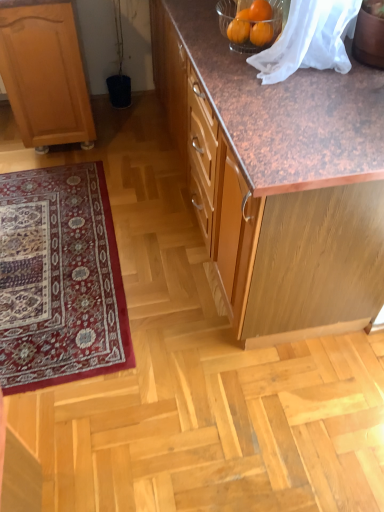
The image size is (384, 512). What do you see at coordinates (261, 33) in the screenshot?
I see `orange matte at upper center, acting as the second orange starting from the top` at bounding box center [261, 33].

Measure the distance between point [229,242] and camera.

A distance of 1.51 meters exists between point [229,242] and camera.

Where is `brown wood cabinet at center, which is counted as the 2th cabinetry, starting from the left`? The height and width of the screenshot is (512, 384). brown wood cabinet at center, which is counted as the 2th cabinetry, starting from the left is located at coordinates (288, 183).

This screenshot has height=512, width=384. Describe the element at coordinates (45, 75) in the screenshot. I see `light brown wood cabinet at left, the 1th cabinetry from the left` at that location.

The height and width of the screenshot is (512, 384). Identify the location of orange matte at upper right, the 1th orange when ordered from top to bottom. (260, 11).

The height and width of the screenshot is (512, 384). Identify the location of carpeted rug at lower left. (59, 279).

In the scene shown: Can you confirm if brown wood cabinet at center, which is counted as the 2th cabinetry, starting from the left, is wider than orange matte at upper right, marked as the 2th orange in a bottom-to-top arrangement?

Indeed, brown wood cabinet at center, which is counted as the 2th cabinetry, starting from the left, has a greater width compared to orange matte at upper right, marked as the 2th orange in a bottom-to-top arrangement.

Is brown wood cabinet at center, which is counted as the 2th cabinetry, starting from the left, positioned far away from orange matte at upper right, the 1th orange when ordered from top to bottom?

Actually, brown wood cabinet at center, which is counted as the 2th cabinetry, starting from the left, and orange matte at upper right, the 1th orange when ordered from top to bottom, are a little close together.

Does brown wood cabinet at center, the 1th cabinetry positioned from the right, have a larger size compared to orange matte at upper right, the 1th orange when ordered from top to bottom?

Yes, brown wood cabinet at center, the 1th cabinetry positioned from the right, is bigger than orange matte at upper right, the 1th orange when ordered from top to bottom.

Is brown wood cabinet at center, which is counted as the 2th cabinetry, starting from the left, facing towards orange matte at upper right, the 1th orange when ordered from top to bottom?

No, brown wood cabinet at center, which is counted as the 2th cabinetry, starting from the left, is not aimed at orange matte at upper right, the 1th orange when ordered from top to bottom.

Is carpeted rug at lower left in front of orange matte at upper right, the 1th orange when ordered from top to bottom?

That is False.

What's the angular difference between carpeted rug at lower left and orange matte at upper right, marked as the 2th orange in a bottom-to-top arrangement,'s facing directions?

The facing directions of carpeted rug at lower left and orange matte at upper right, marked as the 2th orange in a bottom-to-top arrangement, are 95.5 degrees apart.

Who is taller, carpeted rug at lower left or orange matte at upper right, the 1th orange when ordered from top to bottom?

orange matte at upper right, the 1th orange when ordered from top to bottom, is taller.

From the image's perspective, is carpeted rug at lower left beneath orange matte at upper right, marked as the 2th orange in a bottom-to-top arrangement?

Yes, from the image's perspective, carpeted rug at lower left is beneath orange matte at upper right, marked as the 2th orange in a bottom-to-top arrangement.

Is orange matte at upper center, placed as the first orange when sorted from bottom to top, in front of or behind brown wood cabinet at center, the 1th cabinetry positioned from the right, in the image?

orange matte at upper center, placed as the first orange when sorted from bottom to top, is behind brown wood cabinet at center, the 1th cabinetry positioned from the right.

Looking at the image, does orange matte at upper center, acting as the second orange starting from the top, seem bigger or smaller compared to brown wood cabinet at center, which is counted as the 2th cabinetry, starting from the left?

Clearly, orange matte at upper center, acting as the second orange starting from the top, is smaller in size than brown wood cabinet at center, which is counted as the 2th cabinetry, starting from the left.

Is orange matte at upper center, acting as the second orange starting from the top, shorter than brown wood cabinet at center, the 1th cabinetry positioned from the right?

Indeed, orange matte at upper center, acting as the second orange starting from the top, has a lesser height compared to brown wood cabinet at center, the 1th cabinetry positioned from the right.

From a real-world perspective, which object stands above the other?

In real-world perspective, orange matte at upper center, placed as the first orange when sorted from bottom to top, is above.

Can you confirm if light brown wood cabinet at left, the 1th cabinetry from the left, is positioned to the left of orange matte at upper right, the 1th orange when ordered from top to bottom?

Indeed, light brown wood cabinet at left, the 1th cabinetry from the left, is positioned on the left side of orange matte at upper right, the 1th orange when ordered from top to bottom.

Can we say light brown wood cabinet at left, the second cabinetry positioned from the right, lies outside orange matte at upper right, the 1th orange when ordered from top to bottom?

light brown wood cabinet at left, the second cabinetry positioned from the right, lies outside orange matte at upper right, the 1th orange when ordered from top to bottom,'s area.

Does light brown wood cabinet at left, the second cabinetry positioned from the right, touch orange matte at upper right, marked as the 2th orange in a bottom-to-top arrangement?

They are not placed beside each other.

From the image's perspective, is orange matte at upper right, the 1th orange when ordered from top to bottom, above brown wood cabinet at center, the 1th cabinetry positioned from the right?

Correct, orange matte at upper right, the 1th orange when ordered from top to bottom, appears higher than brown wood cabinet at center, the 1th cabinetry positioned from the right, in the image.

Which object is thinner, orange matte at upper right, marked as the 2th orange in a bottom-to-top arrangement, or brown wood cabinet at center, the 1th cabinetry positioned from the right?

orange matte at upper right, marked as the 2th orange in a bottom-to-top arrangement, is thinner.

Is orange matte at upper right, the 1th orange when ordered from top to bottom, facing towards brown wood cabinet at center, which is counted as the 2th cabinetry, starting from the left?

No, orange matte at upper right, the 1th orange when ordered from top to bottom, is not turned towards brown wood cabinet at center, which is counted as the 2th cabinetry, starting from the left.

Considering the sizes of orange matte at upper right, marked as the 2th orange in a bottom-to-top arrangement, and brown wood cabinet at center, the 1th cabinetry positioned from the right, in the image, is orange matte at upper right, marked as the 2th orange in a bottom-to-top arrangement, bigger or smaller than brown wood cabinet at center, the 1th cabinetry positioned from the right,?

Clearly, orange matte at upper right, marked as the 2th orange in a bottom-to-top arrangement, is smaller in size than brown wood cabinet at center, the 1th cabinetry positioned from the right.

Does orange matte at upper center, acting as the second orange starting from the top, have a greater width compared to light brown wood cabinet at left, the second cabinetry positioned from the right?

No, orange matte at upper center, acting as the second orange starting from the top, is not wider than light brown wood cabinet at left, the second cabinetry positioned from the right.

Is the position of orange matte at upper center, placed as the first orange when sorted from bottom to top, less distant than that of light brown wood cabinet at left, the 1th cabinetry from the left?

Yes, orange matte at upper center, placed as the first orange when sorted from bottom to top, is closer to the viewer.

Does orange matte at upper center, acting as the second orange starting from the top, have a greater height compared to light brown wood cabinet at left, the 1th cabinetry from the left?

Incorrect, the height of orange matte at upper center, acting as the second orange starting from the top, is not larger of that of light brown wood cabinet at left, the 1th cabinetry from the left.

In the scene shown: Is brown wood cabinet at center, the 1th cabinetry positioned from the right, outside of light brown wood cabinet at left, the second cabinetry positioned from the right?

Yes, brown wood cabinet at center, the 1th cabinetry positioned from the right, is located beyond the bounds of light brown wood cabinet at left, the second cabinetry positioned from the right.

Which is more to the left, brown wood cabinet at center, which is counted as the 2th cabinetry, starting from the left, or light brown wood cabinet at left, the second cabinetry positioned from the right?

light brown wood cabinet at left, the second cabinetry positioned from the right, is more to the left.

I want to click on cabinetry that appears below the light brown wood cabinet at left, the 1th cabinetry from the left (from the image's perspective), so click(288, 183).

Is brown wood cabinet at center, the 1th cabinetry positioned from the right, aimed at light brown wood cabinet at left, the second cabinetry positioned from the right?

Yes.

From a real-world perspective, count 2nd oranges upward from the brown wood cabinet at center, which is counted as the 2th cabinetry, starting from the left, and point to it. Please provide its 2D coordinates.

[(260, 11)]

You are a GUI agent. You are given a task and a screenshot of the screen. Output one action in this format:
    pyautogui.click(x=<x>, y=<y>)
    Task: Click on the 1st orange to the right of the carpeted rug at lower left, starting your count from the anchor
    The height and width of the screenshot is (512, 384).
    Given the screenshot: What is the action you would take?
    click(260, 11)

In the scene shown: Which object lies further to the anchor point carpeted rug at lower left, brown wood cabinet at center, which is counted as the 2th cabinetry, starting from the left, or orange matte at upper right, the 1th orange when ordered from top to bottom?

orange matte at upper right, the 1th orange when ordered from top to bottom, is further to carpeted rug at lower left.

Consider the image. Considering their positions, is brown wood cabinet at center, the 1th cabinetry positioned from the right, positioned closer to light brown wood cabinet at left, the second cabinetry positioned from the right, than orange matte at upper center, placed as the first orange when sorted from bottom to top?

Among the two, brown wood cabinet at center, the 1th cabinetry positioned from the right, is located nearer to light brown wood cabinet at left, the second cabinetry positioned from the right.

From the image, which object appears to be nearer to orange matte at upper right, the 1th orange when ordered from top to bottom, brown wood cabinet at center, which is counted as the 2th cabinetry, starting from the left, or light brown wood cabinet at left, the 1th cabinetry from the left?

Based on the image, brown wood cabinet at center, which is counted as the 2th cabinetry, starting from the left, appears to be nearer to orange matte at upper right, the 1th orange when ordered from top to bottom.

Estimate the real-world distances between objects in this image. Which object is further from carpeted rug at lower left, orange matte at upper right, the 1th orange when ordered from top to bottom, or light brown wood cabinet at left, the second cabinetry positioned from the right?

orange matte at upper right, the 1th orange when ordered from top to bottom, is further to carpeted rug at lower left.

When comparing their distances from carpeted rug at lower left, does orange matte at upper right, the 1th orange when ordered from top to bottom, or brown wood cabinet at center, the 1th cabinetry positioned from the right, seem further?

orange matte at upper right, the 1th orange when ordered from top to bottom, is further to carpeted rug at lower left.

Looking at the image, which one is located further to brown wood cabinet at center, the 1th cabinetry positioned from the right, orange matte at upper center, acting as the second orange starting from the top, or orange matte at upper right, the 1th orange when ordered from top to bottom?

orange matte at upper right, the 1th orange when ordered from top to bottom, is further to brown wood cabinet at center, the 1th cabinetry positioned from the right.

Consider the image. Estimate the real-world distances between objects in this image. Which object is closer to orange matte at upper right, marked as the 2th orange in a bottom-to-top arrangement, light brown wood cabinet at left, the 1th cabinetry from the left, or brown wood cabinet at center, the 1th cabinetry positioned from the right?

Based on the image, brown wood cabinet at center, the 1th cabinetry positioned from the right, appears to be nearer to orange matte at upper right, marked as the 2th orange in a bottom-to-top arrangement.

Which object lies further to the anchor point orange matte at upper right, marked as the 2th orange in a bottom-to-top arrangement, brown wood cabinet at center, which is counted as the 2th cabinetry, starting from the left, or carpeted rug at lower left?

carpeted rug at lower left.

Image resolution: width=384 pixels, height=512 pixels. In order to click on mat situated between light brown wood cabinet at left, the second cabinetry positioned from the right, and orange matte at upper right, the 1th orange when ordered from top to bottom, from left to right in this screenshot , I will do `click(59, 279)`.

At what (x,y) coordinates should I click in order to perform the action: click on mat between light brown wood cabinet at left, the second cabinetry positioned from the right, and brown wood cabinet at center, which is counted as the 2th cabinetry, starting from the left. Please return your answer as a coordinate pair (x, y). Looking at the image, I should click on (59, 279).

This screenshot has width=384, height=512. What are the coordinates of `orange between brown wood cabinet at center, the 1th cabinetry positioned from the right, and orange matte at upper right, marked as the 2th orange in a bottom-to-top arrangement, along the z-axis` in the screenshot? It's located at (261, 33).

Image resolution: width=384 pixels, height=512 pixels. In order to click on orange located between light brown wood cabinet at left, the 1th cabinetry from the left, and orange matte at upper center, acting as the second orange starting from the top, in the left-right direction in this screenshot , I will do `click(260, 11)`.